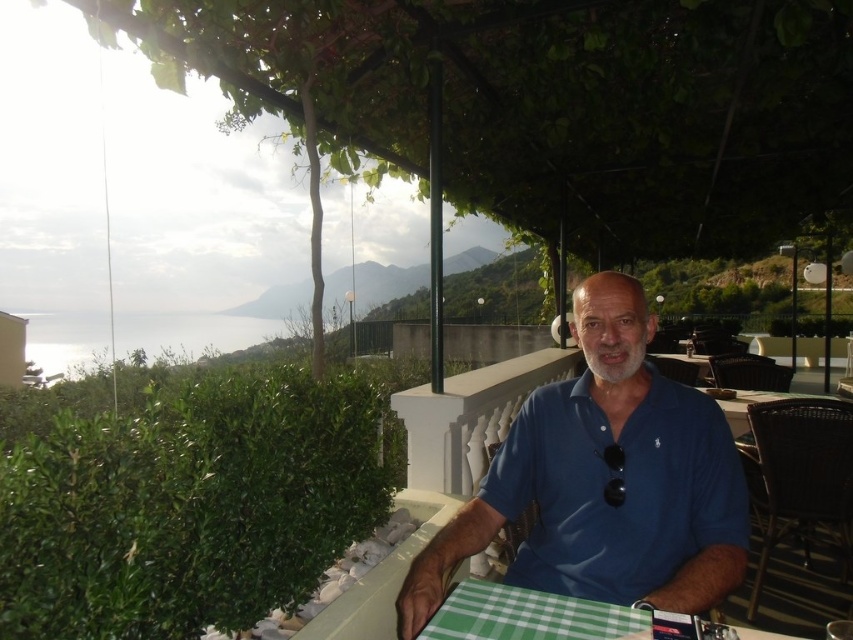
Between point (509, 444) and point (479, 588), which one is positioned in front?

Point (479, 588) is in front.

Can you confirm if blue cotton shirt at center is thinner than green checkered tablecloth at lower center?

In fact, blue cotton shirt at center might be wider than green checkered tablecloth at lower center.

Is point (486, 529) positioned after point (662, 630)?

Yes, it is.

You are a GUI agent. You are given a task and a screenshot of the screen. Output one action in this format:
    pyautogui.click(x=<x>, y=<y>)
    Task: Click on the blue cotton shirt at center
    The width and height of the screenshot is (853, 640).
    Given the screenshot: What is the action you would take?
    pyautogui.click(x=605, y=481)